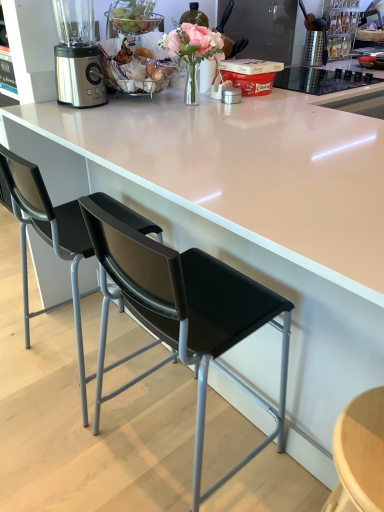
Identify the location of black plastic chair at left, arranged as the 2th chair when viewed from the right. (49, 241).

The image size is (384, 512). I want to click on black leather chair at center, the 1th chair from the right, so click(x=181, y=309).

Identify the location of black plastic chair at left, arranged as the 2th chair when viewed from the right. Image resolution: width=384 pixels, height=512 pixels. (49, 241).

Between black leather chair at center, which is counted as the 2th chair, starting from the left, and metallic grater at upper right, which one is positioned behind?

metallic grater at upper right is further from the camera.

Considering the sizes of black leather chair at center, which is counted as the 2th chair, starting from the left, and metallic grater at upper right in the image, is black leather chair at center, which is counted as the 2th chair, starting from the left, wider or thinner than metallic grater at upper right?

Considering their sizes, black leather chair at center, which is counted as the 2th chair, starting from the left, looks broader than metallic grater at upper right.

How many degrees apart are the facing directions of black leather chair at center, the 1th chair from the right, and metallic grater at upper right?

black leather chair at center, the 1th chair from the right, and metallic grater at upper right are facing 87.9 degrees away from each other.

Can metallic grater at upper right be found inside black leather chair at center, which is counted as the 2th chair, starting from the left?

That's incorrect, metallic grater at upper right is not inside black leather chair at center, which is counted as the 2th chair, starting from the left.

Considering the sizes of objects black plastic chair at left, acting as the first chair starting from the left, and satin silver blender at upper left in the image provided, who is wider, black plastic chair at left, acting as the first chair starting from the left, or satin silver blender at upper left?

black plastic chair at left, acting as the first chair starting from the left, is wider.

The image size is (384, 512). In order to click on chair that is the 1st one below the satin silver blender at upper left (from a real-world perspective) in this screenshot , I will do `click(49, 241)`.

Considering the points (77, 239) and (67, 1), which point is behind, point (77, 239) or point (67, 1)?

Point (67, 1)

Which object is positioned more to the left, black plastic chair at left, arranged as the 2th chair when viewed from the right, or satin silver blender at upper left?

satin silver blender at upper left.

Which is correct: satin silver blender at upper left is inside black plastic chair at left, arranged as the 2th chair when viewed from the right, or outside of it?

satin silver blender at upper left cannot be found inside black plastic chair at left, arranged as the 2th chair when viewed from the right.

From the image's perspective, which is above, satin silver blender at upper left or black plastic chair at left, acting as the first chair starting from the left?

satin silver blender at upper left, from the image's perspective.

Could you tell me if satin silver blender at upper left is turned towards black plastic chair at left, arranged as the 2th chair when viewed from the right?

No, satin silver blender at upper left is not facing towards black plastic chair at left, arranged as the 2th chair when viewed from the right.

Is satin silver blender at upper left to the right of black plastic chair at left, arranged as the 2th chair when viewed from the right, from the viewer's perspective?

No, satin silver blender at upper left is not to the right of black plastic chair at left, arranged as the 2th chair when viewed from the right.

Does point (310, 39) come behind point (257, 316)?

Yes, it is behind point (257, 316).

This screenshot has height=512, width=384. In order to click on chair that is the 1st one when counting leftward from the metallic grater at upper right in this screenshot , I will do `click(181, 309)`.

Would you say metallic grater at upper right is outside black leather chair at center, which is counted as the 2th chair, starting from the left?

Yes, metallic grater at upper right is located beyond the bounds of black leather chair at center, which is counted as the 2th chair, starting from the left.

Can you confirm if satin silver blender at upper left is positioned to the right of black leather chair at center, which is counted as the 2th chair, starting from the left?

No.

Is satin silver blender at upper left spatially inside black leather chair at center, which is counted as the 2th chair, starting from the left, or outside of it?

satin silver blender at upper left is not enclosed by black leather chair at center, which is counted as the 2th chair, starting from the left.

Which of these two, satin silver blender at upper left or black leather chair at center, which is counted as the 2th chair, starting from the left, is bigger?

With larger size is black leather chair at center, which is counted as the 2th chair, starting from the left.

Based on their positions, is satin silver blender at upper left located to the left or right of metallic grater at upper right?

Based on their positions, satin silver blender at upper left is located to the left of metallic grater at upper right.

Does point (61, 40) appear closer or farther from the camera than point (320, 30)?

Point (61, 40) is closer to the camera than point (320, 30).

From the picture: Considering the sizes of objects satin silver blender at upper left and metallic grater at upper right in the image provided, who is bigger, satin silver blender at upper left or metallic grater at upper right?

With larger size is satin silver blender at upper left.

From the picture: Which object is positioned more to the right, metallic grater at upper right or satin silver blender at upper left?

Positioned to the right is metallic grater at upper right.

Does metallic grater at upper right turn towards satin silver blender at upper left?

No, metallic grater at upper right is not oriented towards satin silver blender at upper left.

Are metallic grater at upper right and satin silver blender at upper left located far from each other?

That's right, there is a large distance between metallic grater at upper right and satin silver blender at upper left.

This screenshot has height=512, width=384. What are the coordinates of `kitchen appliance above the black leather chair at center, which is counted as the 2th chair, starting from the left (from a real-world perspective)` in the screenshot? It's located at (315, 48).

From the satin silver blender at upper left, count 1st chairs forward and point to it. Please provide its 2D coordinates.

[(49, 241)]

Considering their positions, is black leather chair at center, the 1th chair from the right, positioned closer to black plastic chair at left, arranged as the 2th chair when viewed from the right, than satin silver blender at upper left?

black leather chair at center, the 1th chair from the right, is positioned closer to the anchor black plastic chair at left, arranged as the 2th chair when viewed from the right.

From the image, which object appears to be nearer to metallic grater at upper right, black plastic chair at left, acting as the first chair starting from the left, or satin silver blender at upper left?

Based on the image, satin silver blender at upper left appears to be nearer to metallic grater at upper right.

Looking at the image, which one is located closer to black leather chair at center, which is counted as the 2th chair, starting from the left, black plastic chair at left, acting as the first chair starting from the left, or satin silver blender at upper left?

black plastic chair at left, acting as the first chair starting from the left, is closer to black leather chair at center, which is counted as the 2th chair, starting from the left.

From the image, which object appears to be nearer to metallic grater at upper right, black plastic chair at left, arranged as the 2th chair when viewed from the right, or black leather chair at center, the 1th chair from the right?

black plastic chair at left, arranged as the 2th chair when viewed from the right, is positioned closer to the anchor metallic grater at upper right.

Considering their positions, is satin silver blender at upper left positioned closer to metallic grater at upper right than black leather chair at center, which is counted as the 2th chair, starting from the left?

satin silver blender at upper left lies closer to metallic grater at upper right than the other object.

Considering their positions, is black leather chair at center, which is counted as the 2th chair, starting from the left, positioned closer to satin silver blender at upper left than black plastic chair at left, acting as the first chair starting from the left?

black plastic chair at left, acting as the first chair starting from the left.

Estimate the real-world distances between objects in this image. Which object is closer to black leather chair at center, which is counted as the 2th chair, starting from the left, metallic grater at upper right or satin silver blender at upper left?

satin silver blender at upper left lies closer to black leather chair at center, which is counted as the 2th chair, starting from the left, than the other object.

From the image, which object appears to be farther from black leather chair at center, which is counted as the 2th chair, starting from the left, metallic grater at upper right or black plastic chair at left, arranged as the 2th chair when viewed from the right?

Among the two, metallic grater at upper right is located further to black leather chair at center, which is counted as the 2th chair, starting from the left.

Find the location of a particular element. The height and width of the screenshot is (512, 384). blender located between black leather chair at center, the 1th chair from the right, and metallic grater at upper right in the depth direction is located at coordinates (77, 55).

The height and width of the screenshot is (512, 384). Identify the location of chair that lies between satin silver blender at upper left and black leather chair at center, which is counted as the 2th chair, starting from the left, from top to bottom. tap(49, 241).

You are a GUI agent. You are given a task and a screenshot of the screen. Output one action in this format:
    pyautogui.click(x=<x>, y=<y>)
    Task: Click on the chair between black leather chair at center, the 1th chair from the right, and metallic grater at upper right from front to back
    This screenshot has height=512, width=384.
    Given the screenshot: What is the action you would take?
    pyautogui.click(x=49, y=241)

In order to click on blender between black plastic chair at left, acting as the first chair starting from the left, and metallic grater at upper right in the front-back direction in this screenshot , I will do `click(77, 55)`.